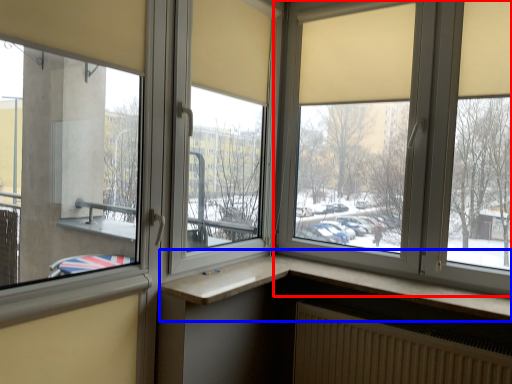
Question: Which point is further to the camera, window (highlighted by a red box) or window (highlighted by a blue box)?

Choices:
 (A) window
 (B) window

Answer: (A)